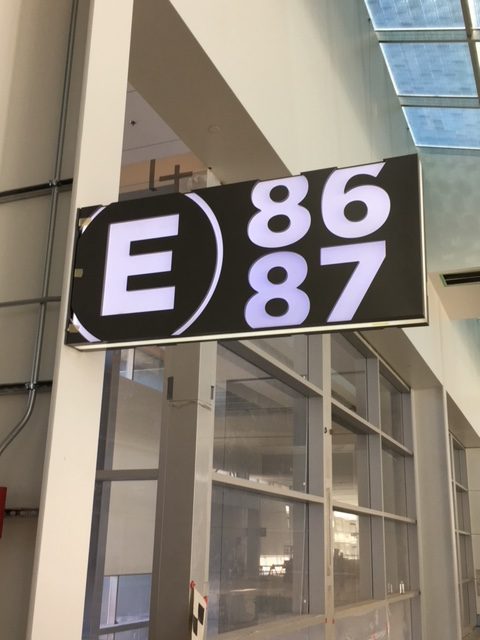
You are a GUI agent. You are given a task and a screenshot of the screen. Output one action in this format:
    pyautogui.click(x=<x>, y=<y>)
    Task: Click on the reflection in window
    
    Given the screenshot: What is the action you would take?
    pyautogui.click(x=274, y=548), pyautogui.click(x=344, y=541)